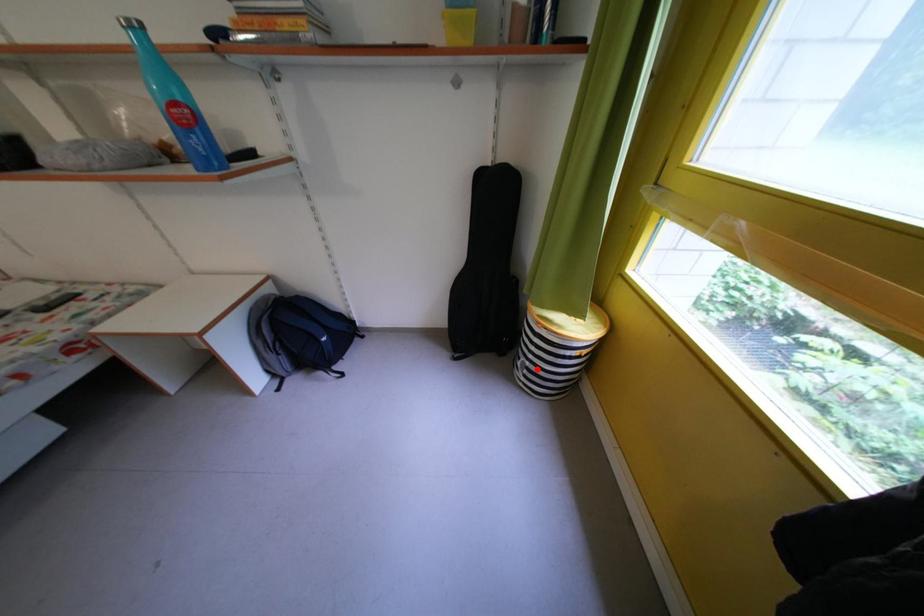
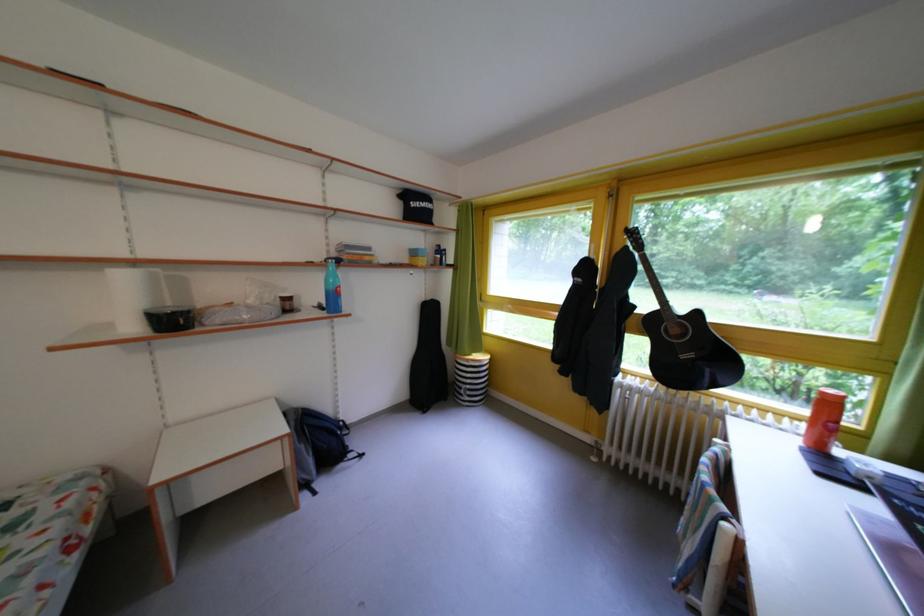
Question: I am providing you with two images of the same scene from different viewpoints. In image1, a red point is highlighted. Considering the same 3D point in image2, which of the following is correct?

Choices:
 (A) It is closer
 (B) It is farther

Answer: (B)